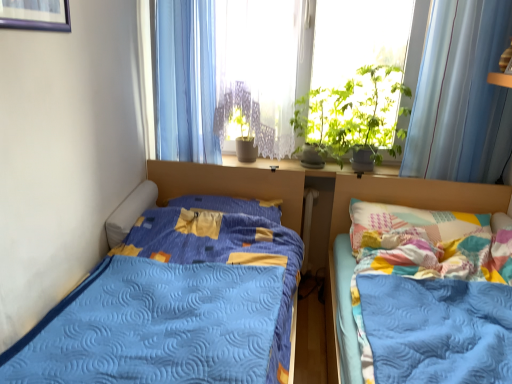
Question: Is translucent fabric at center situated inside light blue sheer curtain at upper right, which ranks as the 1th curtain in right-to-left order, or outside?

Choices:
 (A) outside
 (B) inside

Answer: (A)

Question: In terms of width, does translucent fabric at center look wider or thinner when compared to light blue sheer curtain at upper right, which ranks as the 1th curtain in right-to-left order?

Choices:
 (A) wide
 (B) thin

Answer: (A)

Question: Based on their relative distances, which object is farther from the green leafy plant at upper center?

Choices:
 (A) white plastic radiator at center
 (B) blue sheer curtain at upper center, the 1th curtain when ordered from left to right
 (C) patchwork quilted bed at right, the first bed positioned from the right
 (D) light blue sheer curtain at upper right, which ranks as the 1th curtain in right-to-left order
 (E) white lace curtain at center

Answer: (B)

Question: Based on their relative distances, which object is farther from the blue sheer curtain at upper center, the 1th curtain when ordered from left to right?

Choices:
 (A) green leafy plant at upper center
 (B) blue quilted bed at left, which is counted as the 2th bed, starting from the right
 (C) patchwork quilted bed at right, the first bed positioned from the right
 (D) light blue sheer curtain at upper right, which ranks as the 1th curtain in right-to-left order
 (E) white plastic radiator at center

Answer: (D)